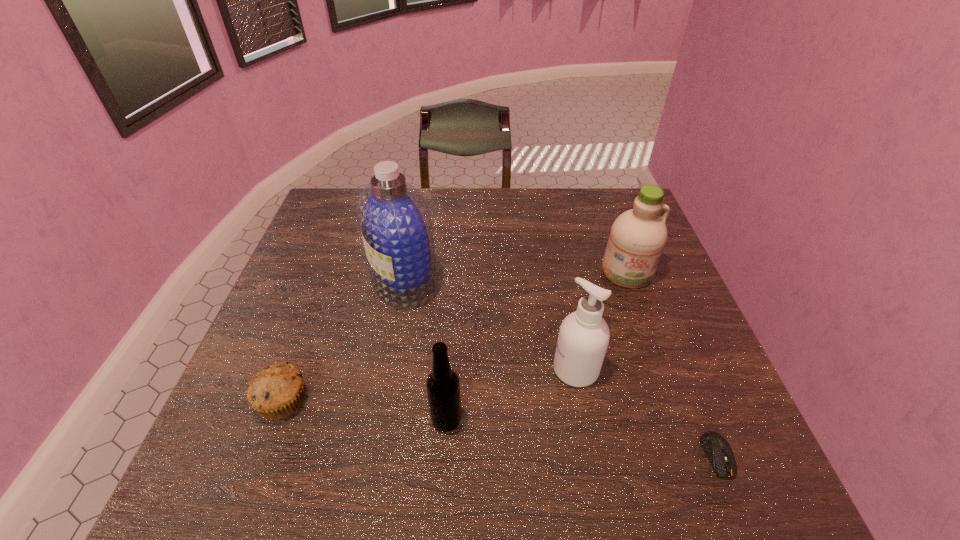
In order to click on the fifth object from right to left in this screenshot , I will do `click(394, 220)`.

At what (x,y) coordinates should I click in order to perform the action: click on the tallest cleansing agent. Please return your answer as a coordinate pair (x, y). The image size is (960, 540). Looking at the image, I should click on (394, 220).

The height and width of the screenshot is (540, 960). Identify the location of the rightmost cleansing agent. (638, 236).

You are a GUI agent. You are given a task and a screenshot of the screen. Output one action in this format:
    pyautogui.click(x=<x>, y=<y>)
    Task: Click on the fourth object from left to right
    Image resolution: width=960 pixels, height=540 pixels.
    Given the screenshot: What is the action you would take?
    pyautogui.click(x=583, y=338)

Locate an element on the screen. This screenshot has height=540, width=960. the second cleansing agent from right to left is located at coordinates (583, 338).

The width and height of the screenshot is (960, 540). I want to click on the fourth object from right to left, so click(443, 387).

At what (x,y) coordinates should I click in order to perform the action: click on the fifth tallest object. Please return your answer as a coordinate pair (x, y). Image resolution: width=960 pixels, height=540 pixels. Looking at the image, I should click on (277, 391).

I want to click on the leftmost object, so click(277, 391).

At what (x,y) coordinates should I click in order to perform the action: click on the shortest object. Please return your answer as a coordinate pair (x, y). Looking at the image, I should click on (716, 447).

This screenshot has width=960, height=540. Find the location of `free spot located 0.050m on the front of the tallest cleansing agent`. free spot located 0.050m on the front of the tallest cleansing agent is located at coordinates (396, 327).